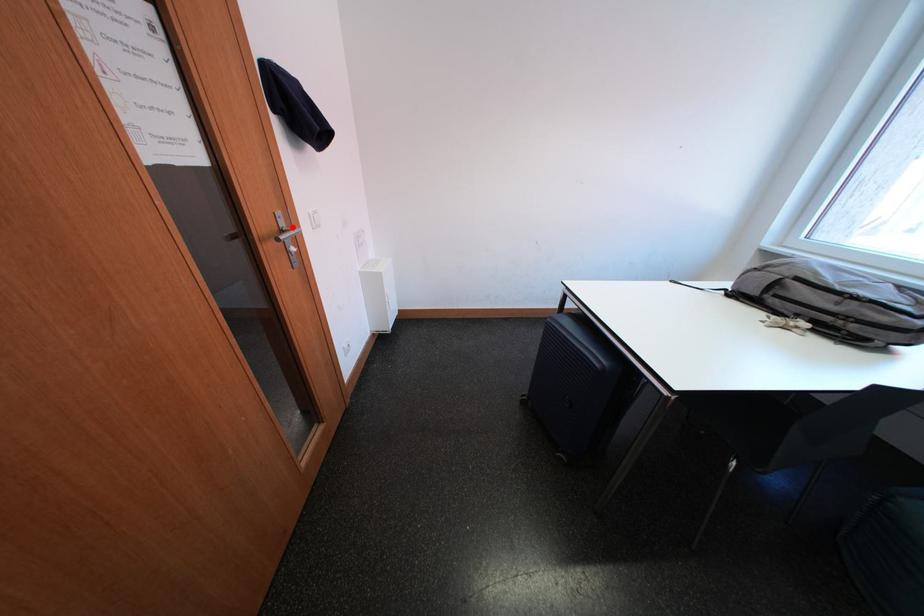
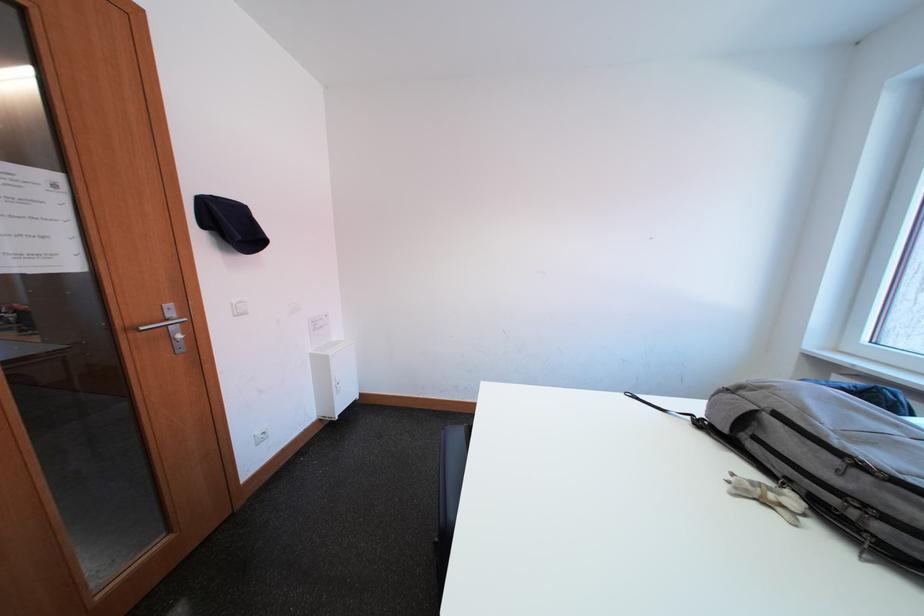
Locate, in the second image, the point that corresponds to the highlighted location in the first image.

(180, 317)